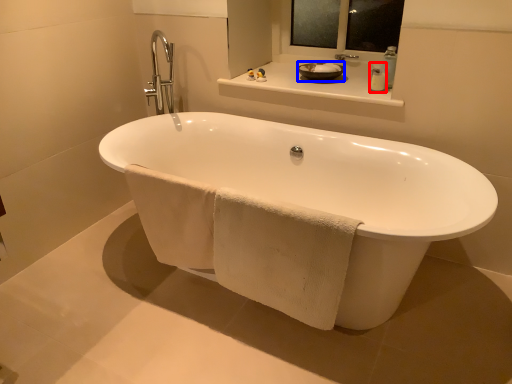
Question: Which of the following is the farthest to the observer, soap dispenser (highlighted by a red box) or basin (highlighted by a blue box)?

Choices:
 (A) soap dispenser
 (B) basin

Answer: (B)